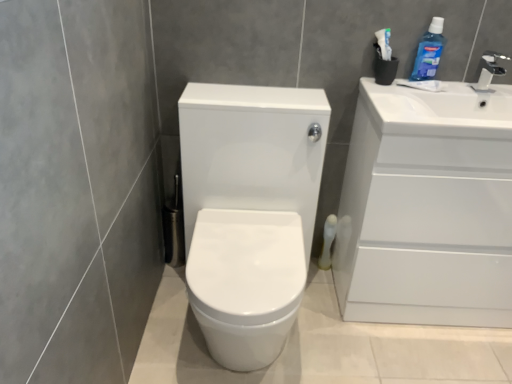
At what (x,y) coordinates should I click in order to perform the action: click on free spot to the left of white glossy faucet at upper right. Please return your answer as a coordinate pair (x, y). Looking at the image, I should click on (451, 81).